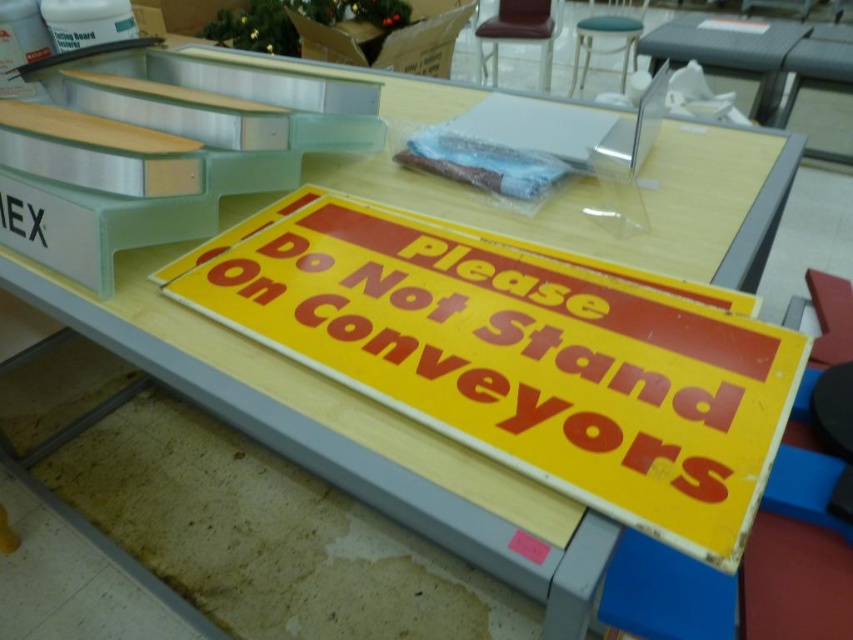
Does clear plastic table at upper right have a greater height compared to metallic silver stool at upper center?

Correct, clear plastic table at upper right is much taller as metallic silver stool at upper center.

Who is higher up, clear plastic table at upper right or metallic silver stool at upper center?

metallic silver stool at upper center is higher up.

Between point (784, 54) and point (624, 80), which one is positioned behind?

The point (624, 80) is more distant.

Where is `clear plastic table at upper right`? The image size is (853, 640). clear plastic table at upper right is located at coordinates (729, 51).